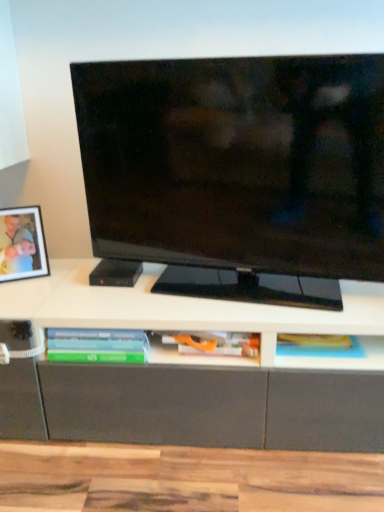
Question: Looking at the image, does matte black picture frame at left seem bigger or smaller compared to matte orange book at center, the second book when ordered from left to right?

Choices:
 (A) small
 (B) big

Answer: (B)

Question: Considering the positions of point (33, 240) and point (213, 342), is point (33, 240) closer or farther from the camera than point (213, 342)?

Choices:
 (A) farther
 (B) closer

Answer: (A)

Question: Estimate the real-world distances between objects in this image. Which object is farther from the matte black tv at center?

Choices:
 (A) translucent plastic book at lower center, the 2th book viewed from the right
 (B) matte orange book at center, the 1th book in the right-to-left sequence
 (C) matte black picture frame at left

Answer: (C)

Question: Which of these objects is positioned farthest from the matte orange book at center, the second book when ordered from left to right?

Choices:
 (A) matte black picture frame at left
 (B) translucent plastic book at lower center, arranged as the first book when viewed from the left
 (C) matte black tv at center

Answer: (A)